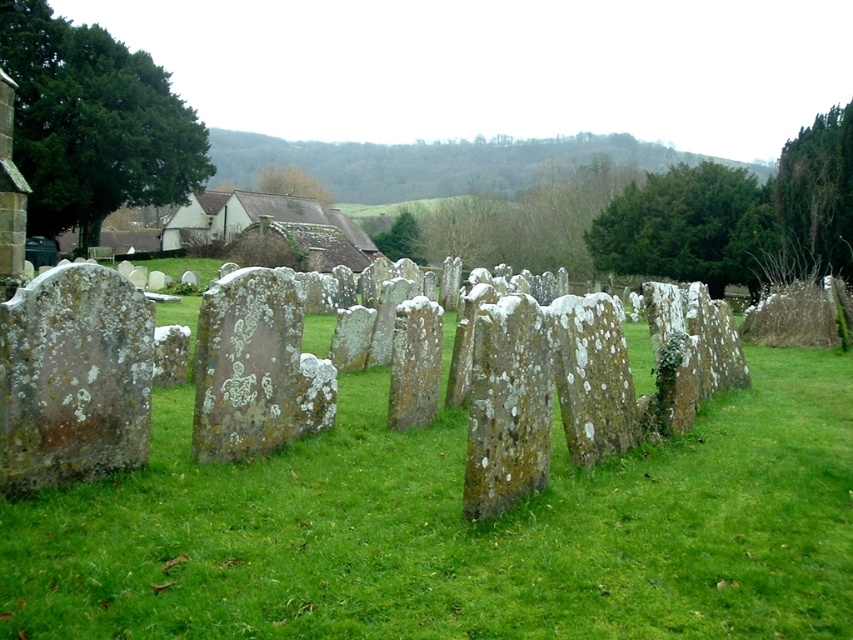
Question: Which point is closer to the camera taking this photo?

Choices:
 (A) (532, 417)
 (B) (129, 364)
 (C) (566, 440)

Answer: (A)

Question: Which point is closer to the camera?

Choices:
 (A) green mossy stone at center
 (B) speckled stone at left

Answer: (B)

Question: Is green mossy stone at center closer to camera compared to speckled stone at center?

Choices:
 (A) no
 (B) yes

Answer: (B)

Question: Can you confirm if green mossy stone at center is positioned to the right of speckled mossy tombstone at center?

Choices:
 (A) yes
 (B) no

Answer: (B)

Question: Which object is closer to the camera taking this photo?

Choices:
 (A) speckled stone at left
 (B) speckled stone at center
 (C) speckled mossy tombstone at center
 (D) green mossy stone at center

Answer: (A)

Question: Can you confirm if speckled stone at left is positioned to the right of speckled mossy tombstone at center?

Choices:
 (A) yes
 (B) no

Answer: (B)